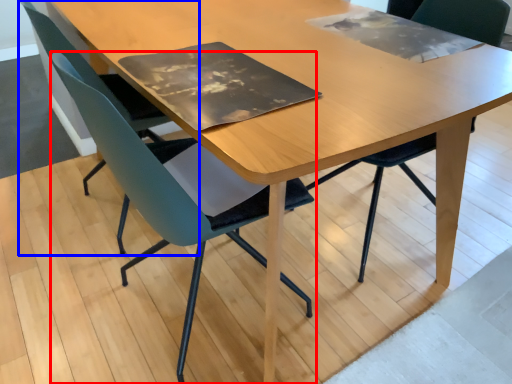
Question: Which object appears closest to the camera in this image, chair (highlighted by a red box) or chair (highlighted by a blue box)?

Choices:
 (A) chair
 (B) chair

Answer: (A)